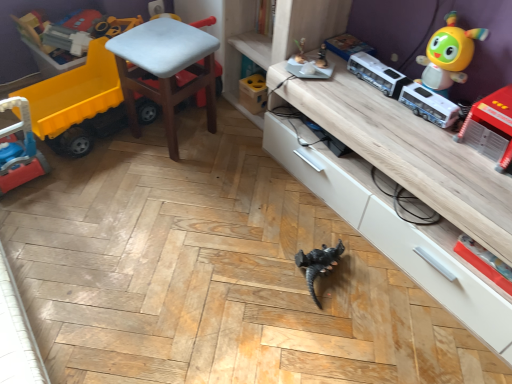
You are a GUI agent. You are given a task and a screenshot of the screen. Output one action in this format:
    pyautogui.click(x=<x>, y=<y>)
    Task: Click on the free space in front of white plastic chair at center
    
    Given the screenshot: What is the action you would take?
    pyautogui.click(x=160, y=179)